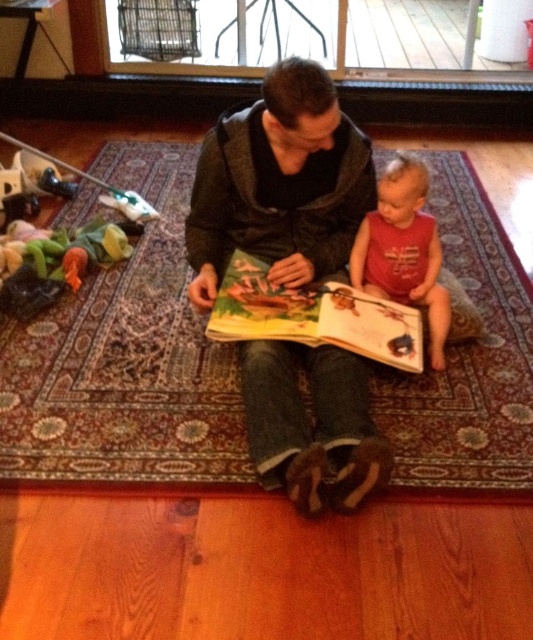
Does hardcover book at center appear on the left side of red cotton shirt at center?

Indeed, hardcover book at center is positioned on the left side of red cotton shirt at center.

Does hardcover book at center appear under red cotton shirt at center?

Yes, hardcover book at center is below red cotton shirt at center.

Is point (243, 332) behind point (414, 241)?

No.

I want to click on hardcover book at center, so click(313, 316).

How distant is hardcover book at center from multicolored plush toy at left?

hardcover book at center is 33.96 inches away from multicolored plush toy at left.

Is hardcover book at center smaller than multicolored plush toy at left?

Yes.

Which is behind, point (385, 317) or point (100, 250)?

Positioned behind is point (100, 250).

Find the location of a particular element. This screenshot has width=533, height=640. hardcover book at center is located at coordinates (313, 316).

Is point (370, 252) farther from camera compared to point (63, 260)?

No, (370, 252) is closer to viewer.

Identify the location of red cotton shirt at center. Image resolution: width=533 pixels, height=640 pixels. (403, 250).